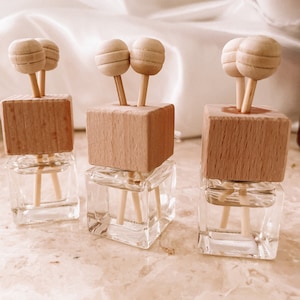
What are the coordinates of `fabric` in the screenshot? It's located at (207, 80).